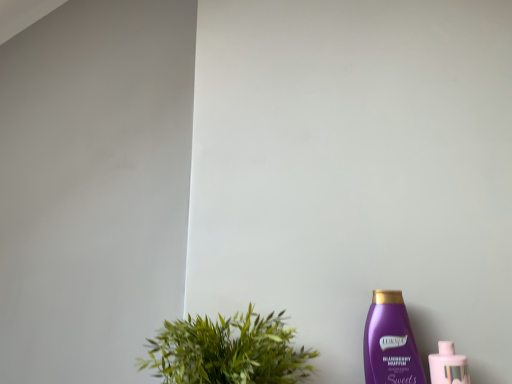
Question: Is pink glossy bottle at lower right, which is the second bottle from left to right, beside green leafy plant at lower left?

Choices:
 (A) no
 (B) yes

Answer: (A)

Question: Would you say pink glossy bottle at lower right, which is the second bottle from left to right, is outside green leafy plant at lower left?

Choices:
 (A) no
 (B) yes

Answer: (B)

Question: From a real-world perspective, is pink glossy bottle at lower right, arranged as the first bottle when viewed from the right, physically below green leafy plant at lower left?

Choices:
 (A) no
 (B) yes

Answer: (B)

Question: From the image's perspective, is pink glossy bottle at lower right, which is the second bottle from left to right, on green leafy plant at lower left?

Choices:
 (A) yes
 (B) no

Answer: (B)

Question: Is pink glossy bottle at lower right, which is the second bottle from left to right, facing away from green leafy plant at lower left?

Choices:
 (A) no
 (B) yes

Answer: (A)

Question: Choose the correct answer: Is pink glossy bottle at lower right, which is the second bottle from left to right, inside purple plastic bottle at lower right, marked as the second bottle in a right-to-left arrangement, or outside it?

Choices:
 (A) outside
 (B) inside

Answer: (A)

Question: In terms of width, does pink glossy bottle at lower right, which is the second bottle from left to right, look wider or thinner when compared to purple plastic bottle at lower right, the first bottle in the left-to-right sequence?

Choices:
 (A) thin
 (B) wide

Answer: (B)

Question: Visually, is pink glossy bottle at lower right, arranged as the first bottle when viewed from the right, positioned to the left or to the right of purple plastic bottle at lower right, the first bottle in the left-to-right sequence?

Choices:
 (A) right
 (B) left

Answer: (A)

Question: From the image's perspective, is pink glossy bottle at lower right, which is the second bottle from left to right, above or below purple plastic bottle at lower right, marked as the second bottle in a right-to-left arrangement?

Choices:
 (A) below
 (B) above

Answer: (A)

Question: From the image's perspective, is green leafy plant at lower left above or below purple plastic bottle at lower right, the first bottle in the left-to-right sequence?

Choices:
 (A) below
 (B) above

Answer: (B)

Question: Is point (268, 319) closer or farther from the camera than point (380, 349)?

Choices:
 (A) closer
 (B) farther

Answer: (B)

Question: Do you think green leafy plant at lower left is within purple plastic bottle at lower right, the first bottle in the left-to-right sequence, or outside of it?

Choices:
 (A) inside
 (B) outside

Answer: (B)

Question: In terms of size, does green leafy plant at lower left appear bigger or smaller than purple plastic bottle at lower right, marked as the second bottle in a right-to-left arrangement?

Choices:
 (A) big
 (B) small

Answer: (A)

Question: Looking at the image, does green leafy plant at lower left seem bigger or smaller compared to pink glossy bottle at lower right, arranged as the first bottle when viewed from the right?

Choices:
 (A) small
 (B) big

Answer: (B)

Question: Does point (275, 357) appear closer or farther from the camera than point (441, 342)?

Choices:
 (A) farther
 (B) closer

Answer: (B)